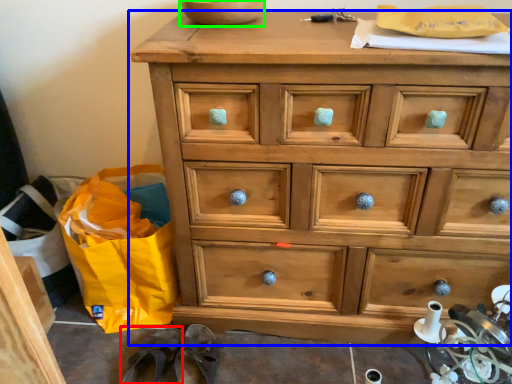
Question: Which object is the farthest from slipper (highlighted by a red box)? Choose among these: chest of drawers (highlighted by a blue box) or bowl (highlighted by a green box).

Choices:
 (A) chest of drawers
 (B) bowl

Answer: (B)